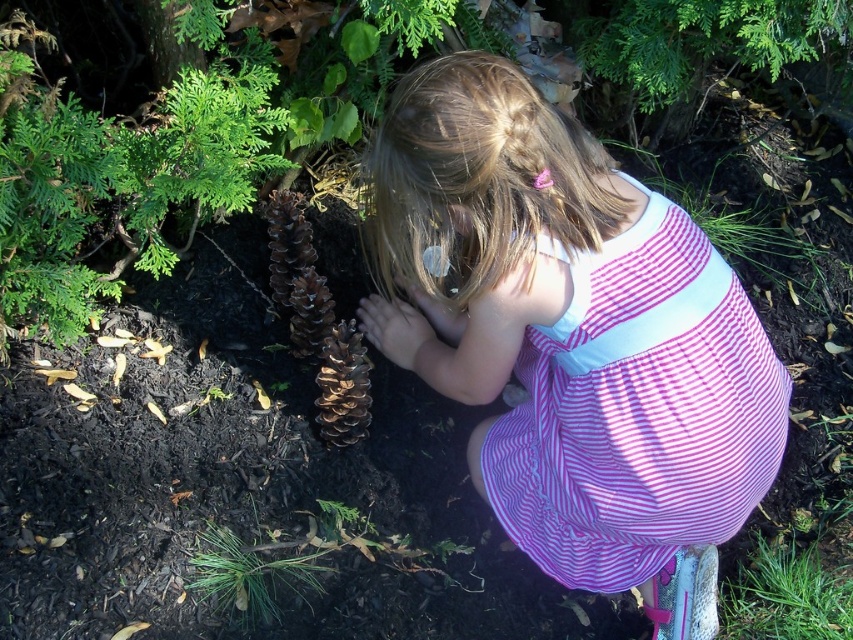
Question: Can you confirm if green matte pinecone at lower center is positioned to the right of brown matte pine cone at center?

Choices:
 (A) yes
 (B) no

Answer: (B)

Question: Considering the relative positions of green matte pinecone at lower center and brown matte pine cone at center in the image provided, where is green matte pinecone at lower center located with respect to brown matte pine cone at center?

Choices:
 (A) right
 (B) left

Answer: (B)

Question: Does pink striped dress at center have a larger size compared to green matte pinecone at lower center?

Choices:
 (A) no
 (B) yes

Answer: (B)

Question: Based on their relative distances, which object is farther from the pink striped dress at center?

Choices:
 (A) brown matte pine cone at center
 (B) green matte pinecone at lower center

Answer: (B)

Question: Based on their relative distances, which object is nearer to the green matte pinecone at lower center?

Choices:
 (A) brown matte pine cone at center
 (B) pink striped dress at center

Answer: (A)

Question: Which point is closer to the camera taking this photo?

Choices:
 (A) (624, 401)
 (B) (248, 605)
 (C) (334, 353)

Answer: (A)